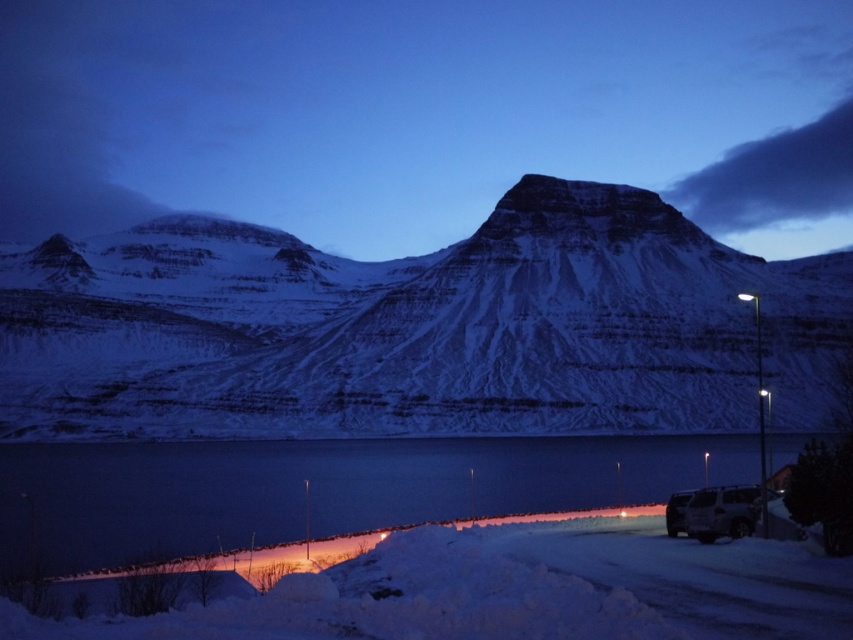
You are planning to cross the smooth ice lake at lower center with your silver metallic van at lower right. Based on the scene, can the van safely drive across the lake?

The smooth ice lake at lower center is wider than the silver metallic van at lower right, but the description does not provide information about the ice thickness or the van weight. Therefore, it is impossible to determine if the van can safely drive across the lake.

You are a traveler driving a car and want to take a photo of the snowy mountain at center and the silver metallic van at lower right. To capture both in one frame, should you position yourself to the left or right of the van?

You should position yourself to the right of the silver metallic van at lower right because the snowy mountain at center is located to the left of the van, so placing yourself to the right would allow both the mountain and the van to be in the frame.